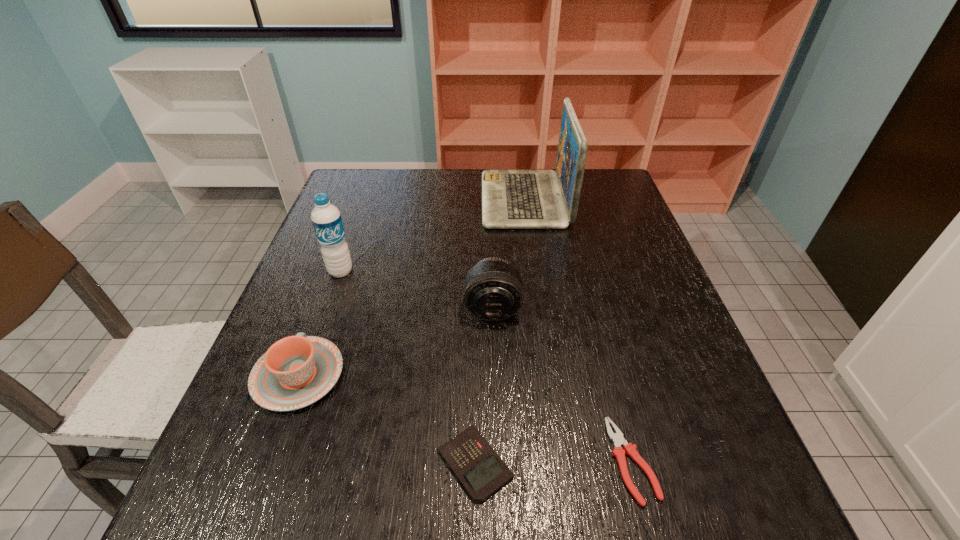
Locate an element on the screen. The image size is (960, 540). vacant space at the far left corner of the desktop is located at coordinates (366, 195).

The width and height of the screenshot is (960, 540). What are the coordinates of `free spot at the far right corner of the desktop` in the screenshot? It's located at (612, 202).

Locate an element on the screen. free space at the near right corner of the desktop is located at coordinates (699, 496).

Where is `free spot between the fourth nearest object and the tallest object`? free spot between the fourth nearest object and the tallest object is located at coordinates (509, 254).

Where is `vacant area that lies between the water bottle and the pliers`? vacant area that lies between the water bottle and the pliers is located at coordinates (487, 366).

Where is `vacant space that is in between the second farthest object and the pliers`? The image size is (960, 540). vacant space that is in between the second farthest object and the pliers is located at coordinates (487, 366).

Identify the location of free area in between the second shortest object and the third farthest object. The height and width of the screenshot is (540, 960). (484, 386).

At what (x,y) coordinates should I click in order to perform the action: click on free space between the pliers and the chinaware. Please return your answer as a coordinate pair (x, y). The width and height of the screenshot is (960, 540). Looking at the image, I should click on (466, 418).

I want to click on vacant point located between the shortest object and the calculator, so click(554, 462).

Where is `vacant space that's between the fourth tallest object and the farthest object`? Image resolution: width=960 pixels, height=540 pixels. vacant space that's between the fourth tallest object and the farthest object is located at coordinates (412, 288).